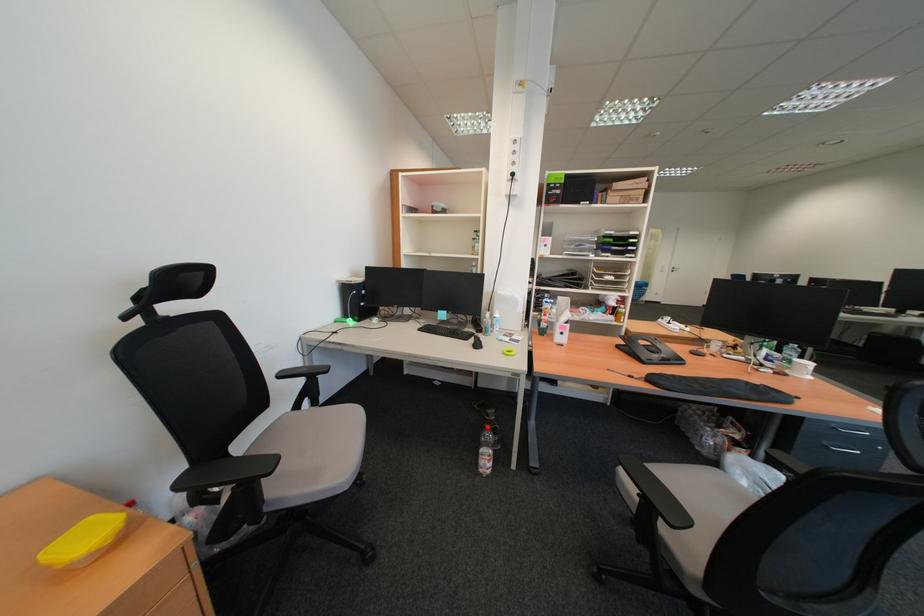
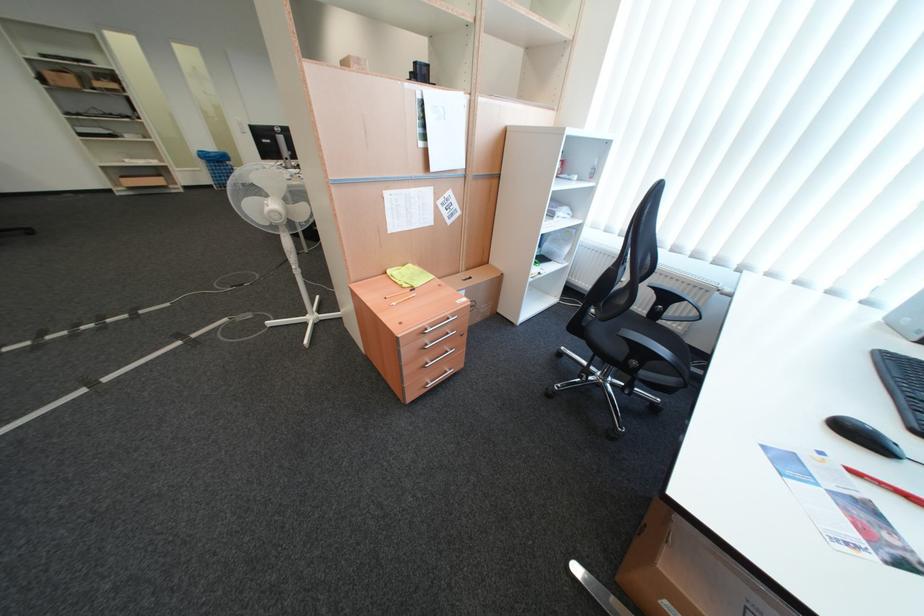
Find the pixel in the second image that matches (649,291) in the first image.

(227, 168)